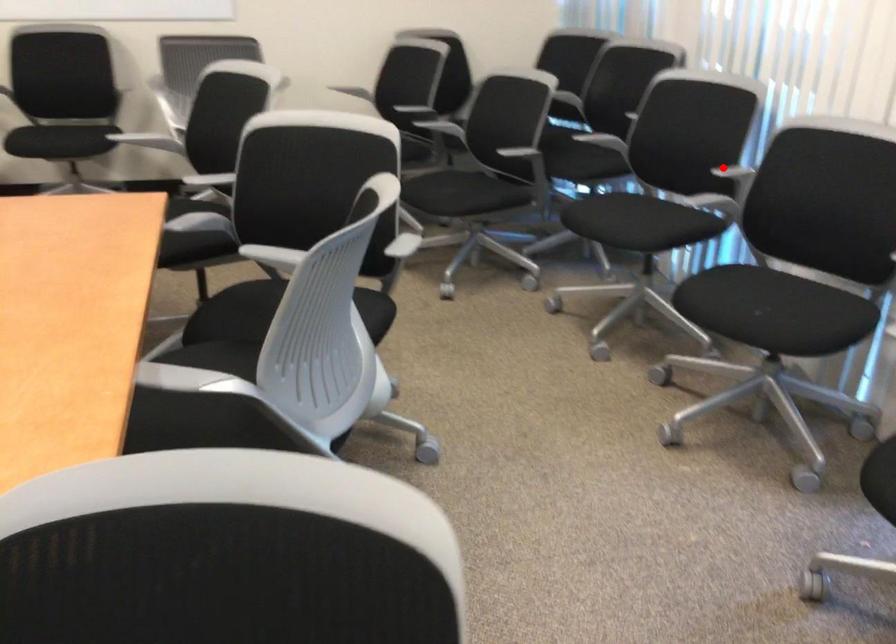
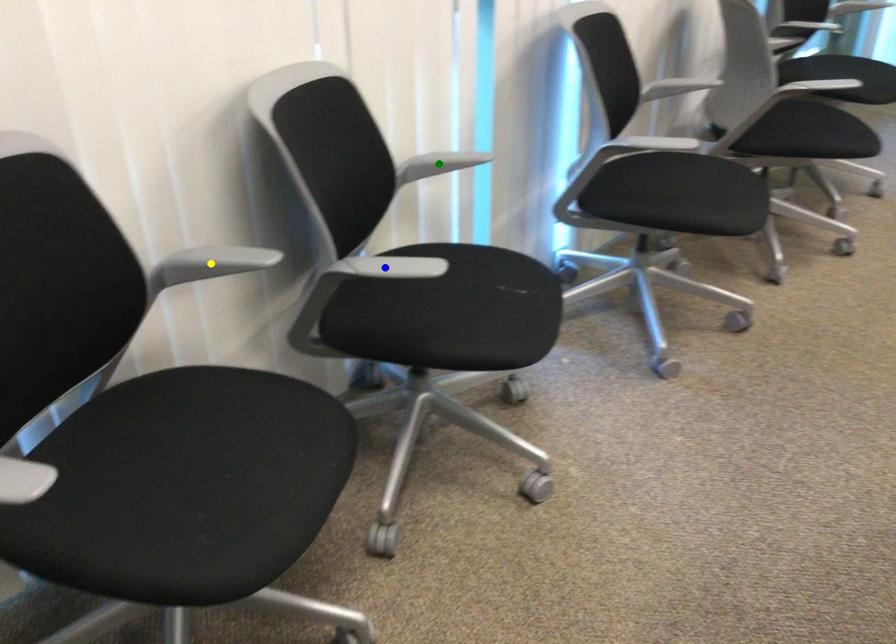
Question: I am providing you with two images of the same scene from different viewpoints. A red point is marked on the first image. You are given multiple points on the second image. Which mark in image 2 goes with the point in image 1?

Choices:
 (A) blue point
 (B) yellow point
 (C) green point

Answer: (B)